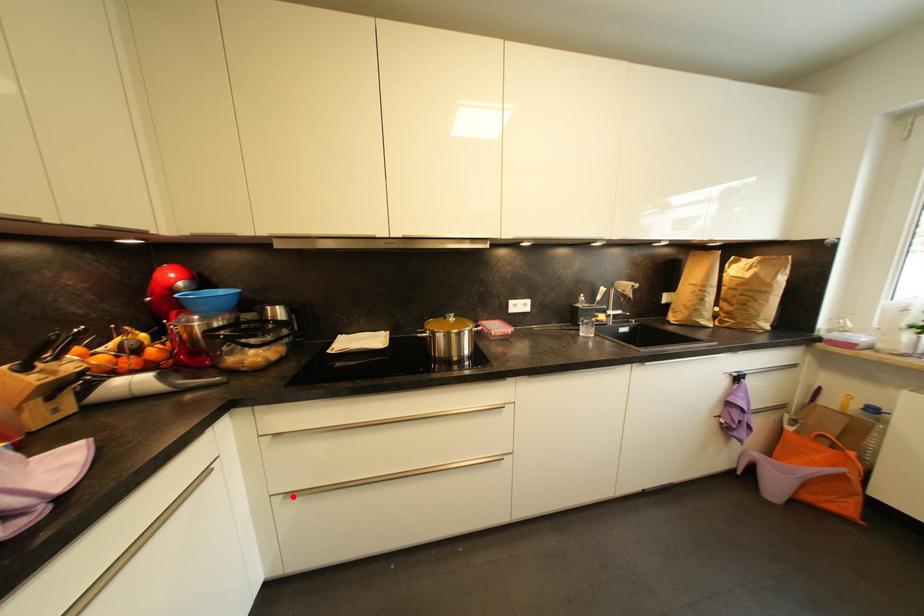
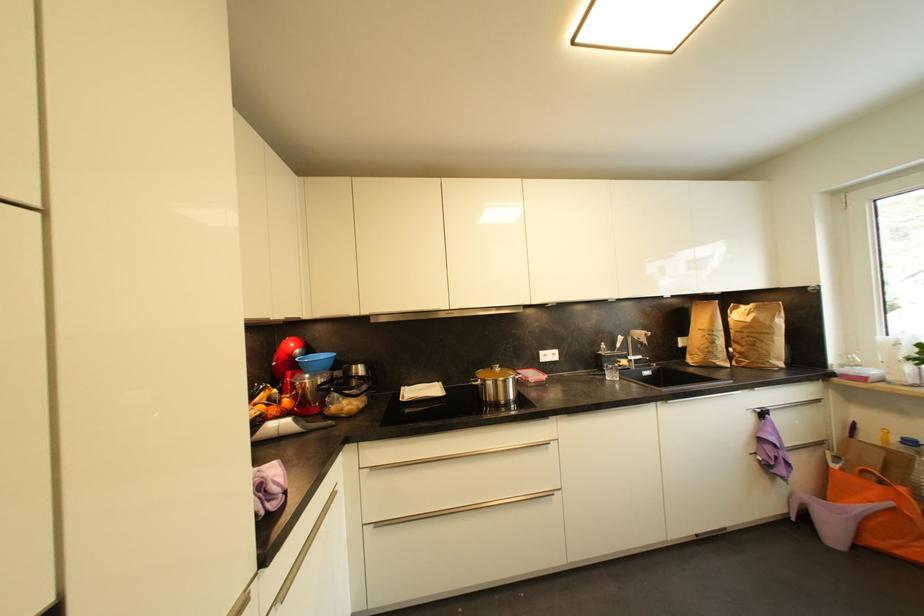
In the second image, find the point that corresponds to the highlighted location in the first image.

(382, 527)